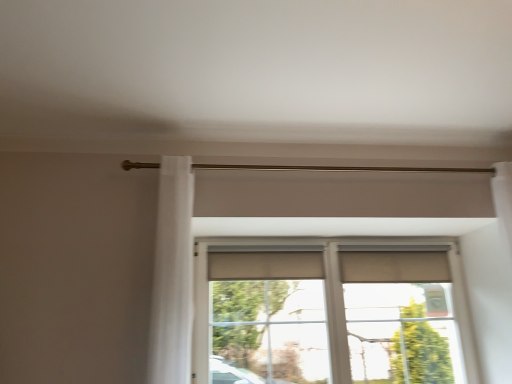
Question: Should I look upward or downward to see white sheer curtain at left?

Choices:
 (A) up
 (B) down

Answer: (B)

Question: Is the depth of white sheer curtain at left greater than that of matte beige window at center?

Choices:
 (A) no
 (B) yes

Answer: (A)

Question: From the image's perspective, is white sheer curtain at left under matte beige window at center?

Choices:
 (A) yes
 (B) no

Answer: (B)

Question: Is white sheer curtain at left in front of matte beige window at center?

Choices:
 (A) no
 (B) yes

Answer: (B)

Question: Is white sheer curtain at left touching matte beige window at center?

Choices:
 (A) no
 (B) yes

Answer: (A)

Question: Is white sheer curtain at left aimed at matte beige window at center?

Choices:
 (A) no
 (B) yes

Answer: (A)

Question: From a real-world perspective, does white sheer curtain at left sit lower than matte beige window at center?

Choices:
 (A) yes
 (B) no

Answer: (B)

Question: Does matte beige window at center have a smaller size compared to white sheer curtain at left?

Choices:
 (A) no
 (B) yes

Answer: (A)

Question: Considering the relative sizes of matte beige window at center and white sheer curtain at left in the image provided, is matte beige window at center wider than white sheer curtain at left?

Choices:
 (A) no
 (B) yes

Answer: (A)

Question: Is matte beige window at center positioned with its back to white sheer curtain at left?

Choices:
 (A) yes
 (B) no

Answer: (B)

Question: From a real-world perspective, is matte beige window at center positioned under white sheer curtain at left based on gravity?

Choices:
 (A) no
 (B) yes

Answer: (B)

Question: Is matte beige window at center placed right next to white sheer curtain at left?

Choices:
 (A) no
 (B) yes

Answer: (A)

Question: From the image's perspective, is matte beige window at center under white sheer curtain at left?

Choices:
 (A) yes
 (B) no

Answer: (A)

Question: From the image's perspective, is matte beige window at center located above or below white sheer curtain at left?

Choices:
 (A) below
 (B) above

Answer: (A)